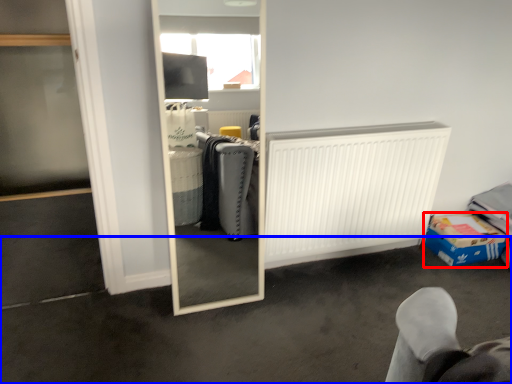
Question: Which object appears farthest to the camera in this image, cardboard box (highlighted by a red box) or concrete (highlighted by a blue box)?

Choices:
 (A) cardboard box
 (B) concrete

Answer: (A)